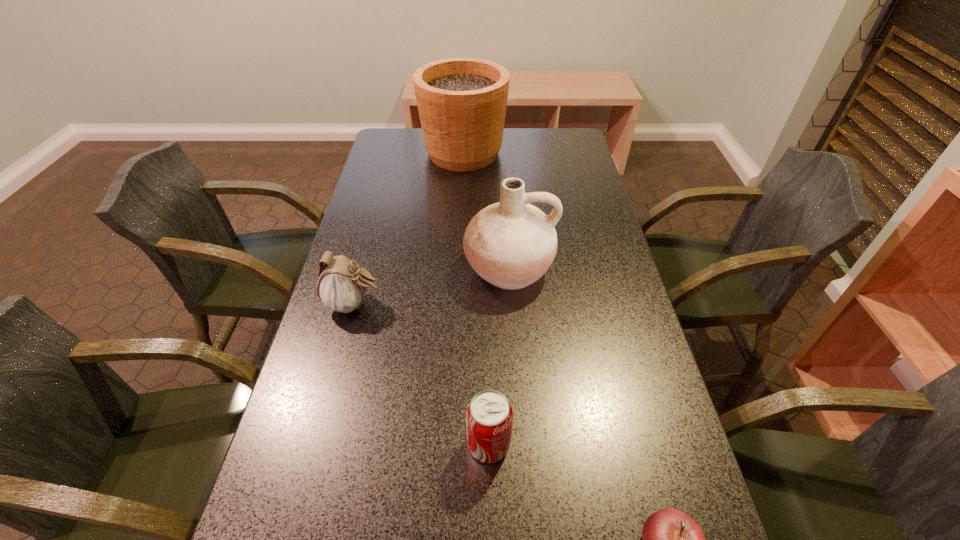
At what (x,y) coordinates should I click in order to perform the action: click on pouch present at the left edge. Please return your answer as a coordinate pair (x, y). Looking at the image, I should click on (342, 286).

Where is `object present at the far left corner`? This screenshot has width=960, height=540. object present at the far left corner is located at coordinates (462, 102).

Where is `free region at the far edge`? free region at the far edge is located at coordinates (512, 132).

In the image, there is a desktop. Where is `vacant space at the left edge`? vacant space at the left edge is located at coordinates (359, 448).

I want to click on vacant space at the right edge of the desktop, so click(578, 234).

Where is `free space between the pottery and the fourth farthest object`? Image resolution: width=960 pixels, height=540 pixels. free space between the pottery and the fourth farthest object is located at coordinates (498, 356).

You are a GUI agent. You are given a task and a screenshot of the screen. Output one action in this format:
    pyautogui.click(x=<x>, y=<y>)
    Task: Click on the free spot between the pouch and the farthest object
    The height and width of the screenshot is (540, 960).
    Given the screenshot: What is the action you would take?
    pyautogui.click(x=409, y=229)

Where is `vacant space in between the soda and the pottery`? The height and width of the screenshot is (540, 960). vacant space in between the soda and the pottery is located at coordinates (498, 356).

You are a GUI agent. You are given a task and a screenshot of the screen. Output one action in this format:
    pyautogui.click(x=<x>, y=<y>)
    Task: Click on the vacant region between the flowerpot and the leftmost object
    Image resolution: width=960 pixels, height=540 pixels.
    Given the screenshot: What is the action you would take?
    (409, 229)

Locate an element on the screen. free area in between the soda and the farthest object is located at coordinates (476, 299).